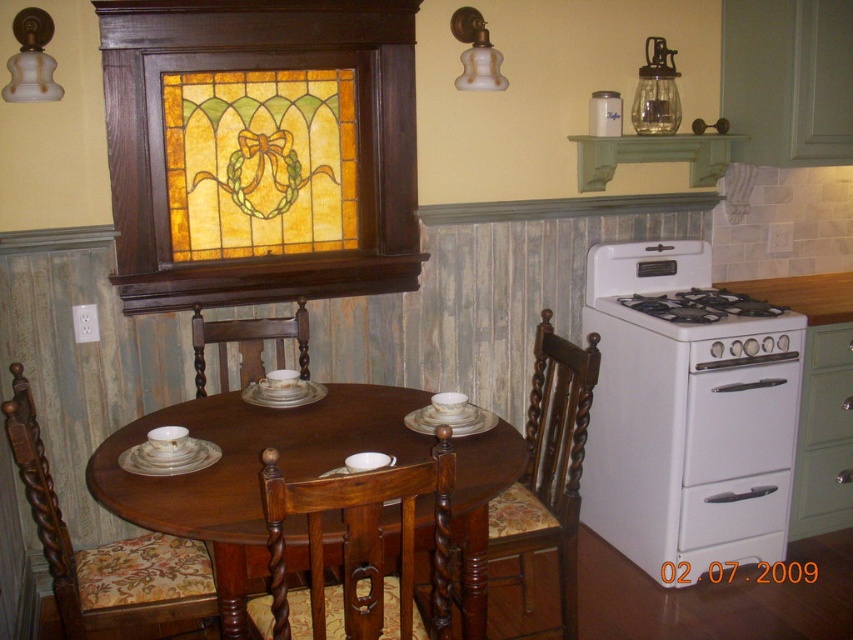
Question: Considering the relative positions of mahogany wood table at center and green matte drawer at right in the image provided, where is mahogany wood table at center located with respect to green matte drawer at right?

Choices:
 (A) left
 (B) right

Answer: (A)

Question: Estimate the real-world distances between objects in this image. Which object is closer to the white glossy drawer at lower right?

Choices:
 (A) floral fabric cushioned chair at center
 (B) green matte drawer at right

Answer: (B)

Question: Can you confirm if white matte oven at right is positioned to the right of mahogany wood table at center?

Choices:
 (A) yes
 (B) no

Answer: (A)

Question: Considering the real-world distances, which object is farthest from the green matte drawer at lower right?

Choices:
 (A) mahogany wood table at center
 (B) floral fabric cushioned chair at center
 (C) white glossy drawer at lower right

Answer: (B)

Question: Which object is positioned closest to the white glossy gas stove at right?

Choices:
 (A) white glossy drawer at lower right
 (B) white wood drawer at right

Answer: (B)

Question: Can you confirm if wooden chair with floral cushion at lower center is thinner than green matte drawer at lower right?

Choices:
 (A) yes
 (B) no

Answer: (B)